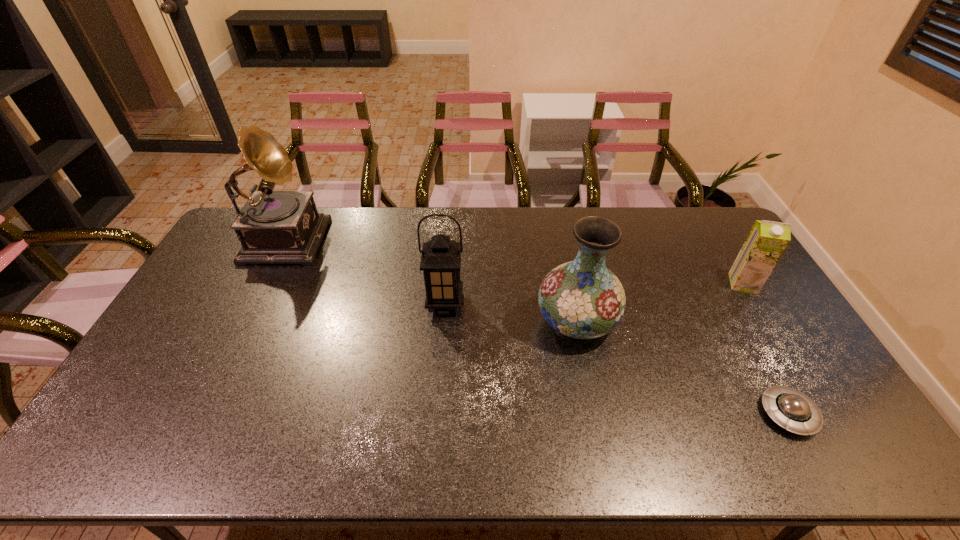
Locate an element on the screen. Image resolution: width=960 pixels, height=540 pixels. the tallest object is located at coordinates (274, 227).

This screenshot has height=540, width=960. I want to click on record player, so click(x=274, y=227).

I want to click on vase, so click(x=582, y=299).

The height and width of the screenshot is (540, 960). I want to click on lantern, so click(x=440, y=262).

You are a GUI agent. You are given a task and a screenshot of the screen. Output one action in this format:
    pyautogui.click(x=<x>, y=<y>)
    Task: Click on the fourth tallest object
    
    Given the screenshot: What is the action you would take?
    [x=765, y=244]

Locate an element on the screen. This screenshot has height=540, width=960. saucer is located at coordinates (791, 409).

Where is `the nearest object`? This screenshot has width=960, height=540. the nearest object is located at coordinates (791, 409).

Identify the location of free region located on the horn of the tallest object. The image size is (960, 540). (403, 235).

Where is `vacant space located on the left of the vase`? vacant space located on the left of the vase is located at coordinates (467, 321).

Locate an element on the screen. Image resolution: width=960 pixels, height=540 pixels. vacant space located 0.340m on the front of the lantern is located at coordinates (436, 421).